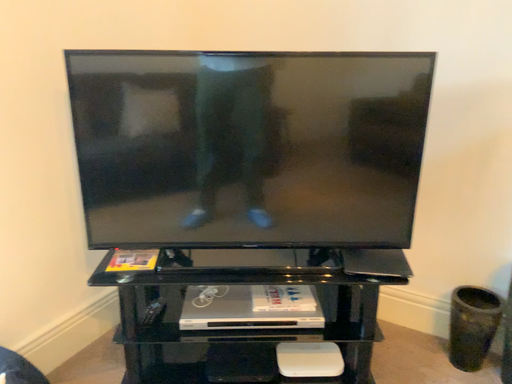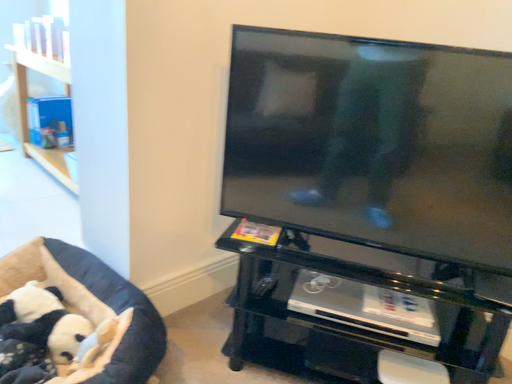
Question: Which way did the camera rotate in the video?

Choices:
 (A) rotated right
 (B) rotated left

Answer: (B)